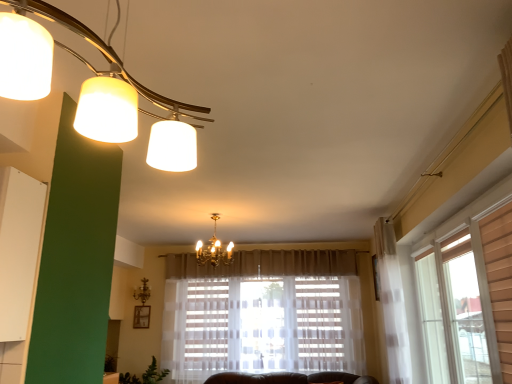
Question: Looking at their shapes, would you say gold metallic chandelier at center, arranged as the first lamp when viewed from the left, is wider or thinner than white matte lampshade at upper left, which ranks as the third lamp in bottom-to-top order?

Choices:
 (A) wide
 (B) thin

Answer: (B)

Question: From the image's perspective, is gold metallic chandelier at center, the 1th lamp when ordered from back to front, above or below white matte lampshade at upper left, the third lamp positioned from the back?

Choices:
 (A) above
 (B) below

Answer: (B)

Question: Which of these objects is positioned closest to the white matte lampshade at upper left, positioned as the 1th lamp in top-to-bottom order?

Choices:
 (A) gold metallic chandelier at center, which is counted as the 3th lamp, starting from the right
 (B) gold metallic chandelier at center, the 2th lamp positioned from the front

Answer: (B)

Question: Considering the real-world distances, which object is closest to the white matte lampshade at upper left, the third lamp positioned from the back?

Choices:
 (A) gold metallic chandelier at center, the third lamp from the top
 (B) gold metallic chandelier at center, the second lamp when ordered from left to right

Answer: (B)